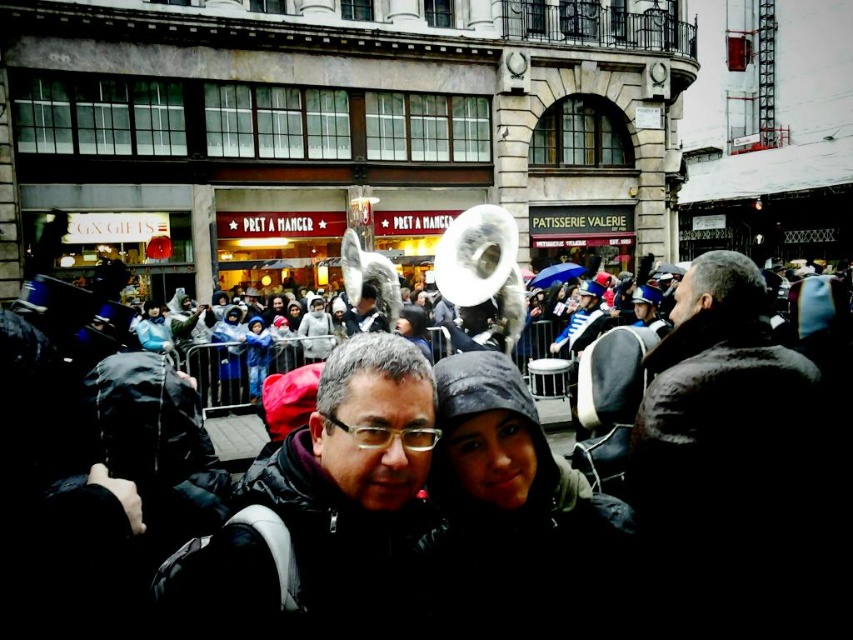
Based on the photo, you are a photographer trying to capture a photo of both the matte blue jacket at center and the blue fleece jacket at center. Since you can only focus on one jacket at a time, which jacket should you focus on first if you want to ensure both are in the frame without moving the camera?

You should focus on the matte blue jacket at center first because it is positioned to the left of the blue fleece jacket at center, so by centering the camera on the matte blue jacket at center, you can adjust the zoom to include both jackets in the frame without moving the camera.

You are a photographer at the event and want to ensure both the dark gray jacket at center and the dark gray hooded jacket at center are clearly visible in your photo. Given their sizes, which jacket should you focus on first to ensure it doesn

The dark gray jacket at center is larger than the dark gray hooded jacket at center, so focusing on it first will help ensure both are visible in the photo.